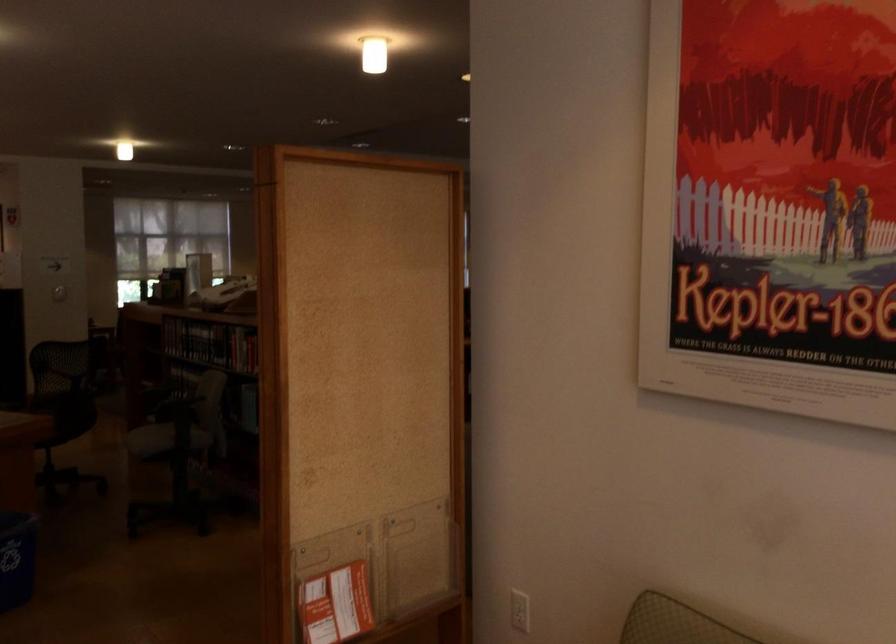
The height and width of the screenshot is (644, 896). What do you see at coordinates (520, 610) in the screenshot?
I see `the white light switch` at bounding box center [520, 610].